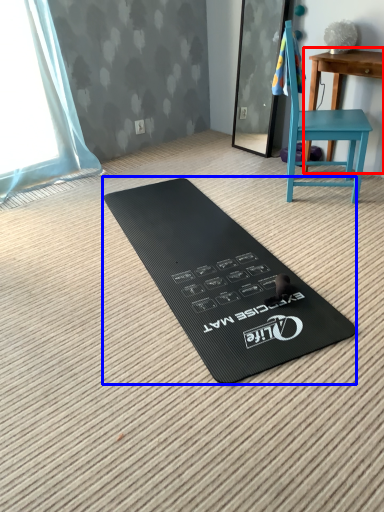
Question: Which object appears closest to the camera in this image, table (highlighted by a red box) or yoga mat (highlighted by a blue box)?

Choices:
 (A) table
 (B) yoga mat

Answer: (B)